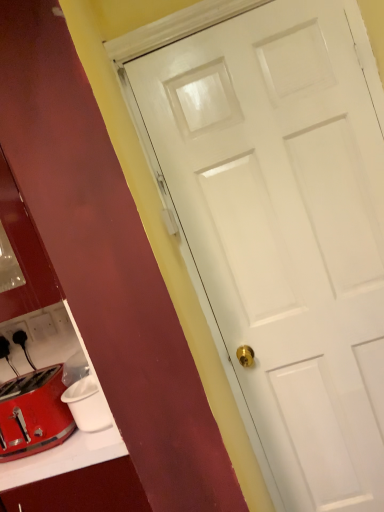
Question: Does white plastic electric outlet at lower left, which is the second electric outlet from left to right, have a greater height compared to shiny metallic toaster at lower left?

Choices:
 (A) yes
 (B) no

Answer: (B)

Question: Is white plastic electric outlet at lower left, which is the second electric outlet from left to right, not near shiny metallic toaster at lower left?

Choices:
 (A) yes
 (B) no

Answer: (B)

Question: Is white plastic electric outlet at lower left, positioned as the first electric outlet in right-to-left order, in front of shiny metallic toaster at lower left?

Choices:
 (A) no
 (B) yes

Answer: (A)

Question: From the image's perspective, is white plastic electric outlet at lower left, positioned as the first electric outlet in right-to-left order, above shiny metallic toaster at lower left?

Choices:
 (A) yes
 (B) no

Answer: (A)

Question: Is white plastic electric outlet at lower left, which is the second electric outlet from left to right, to the right of shiny metallic toaster at lower left from the viewer's perspective?

Choices:
 (A) no
 (B) yes

Answer: (A)

Question: From a real-world perspective, is white plastic electric outlet at lower left, positioned as the first electric outlet in right-to-left order, on top of shiny metallic toaster at lower left?

Choices:
 (A) yes
 (B) no

Answer: (A)

Question: Is shiny metallic toaster at lower left surrounded by black plastic electric outlet at lower left, positioned as the 1th electric outlet in left-to-right order?

Choices:
 (A) no
 (B) yes

Answer: (A)

Question: Is the depth of black plastic electric outlet at lower left, arranged as the 2th electric outlet when viewed from the right, greater than that of shiny metallic toaster at lower left?

Choices:
 (A) no
 (B) yes

Answer: (B)

Question: From a real-world perspective, is black plastic electric outlet at lower left, positioned as the 1th electric outlet in left-to-right order, under shiny metallic toaster at lower left?

Choices:
 (A) no
 (B) yes

Answer: (A)

Question: Does black plastic electric outlet at lower left, arranged as the 2th electric outlet when viewed from the right, have a lesser width compared to shiny metallic toaster at lower left?

Choices:
 (A) yes
 (B) no

Answer: (A)

Question: Considering the relative sizes of black plastic electric outlet at lower left, positioned as the 1th electric outlet in left-to-right order, and shiny metallic toaster at lower left in the image provided, is black plastic electric outlet at lower left, positioned as the 1th electric outlet in left-to-right order, wider than shiny metallic toaster at lower left?

Choices:
 (A) yes
 (B) no

Answer: (B)

Question: Is black plastic electric outlet at lower left, positioned as the 1th electric outlet in left-to-right order, taller than shiny metallic toaster at lower left?

Choices:
 (A) no
 (B) yes

Answer: (A)

Question: Can you confirm if shiny metallic toaster at lower left is shorter than black plastic electric outlet at lower left, positioned as the 1th electric outlet in left-to-right order?

Choices:
 (A) no
 (B) yes

Answer: (A)